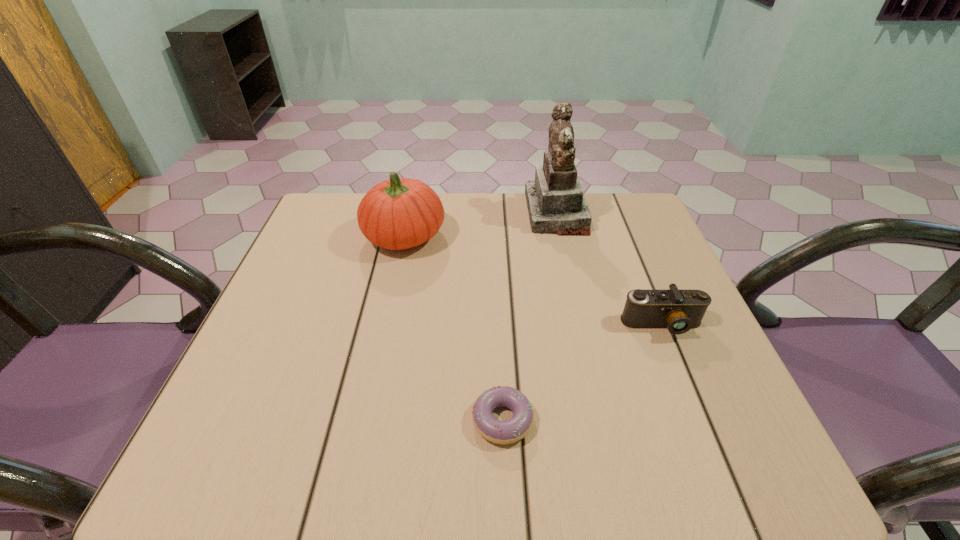
In the image, there is a desktop. Identify the location of blank space at the far edge. point(478,194).

Where is `vacant position at the near edge of the desktop`? This screenshot has height=540, width=960. vacant position at the near edge of the desktop is located at coordinates (640, 434).

The width and height of the screenshot is (960, 540). In the image, there is a desktop. What are the coordinates of `free region at the left edge` in the screenshot? It's located at (314, 258).

Identify the location of vacant space at the right edge of the desktop. This screenshot has width=960, height=540. (694, 379).

The height and width of the screenshot is (540, 960). In order to click on vacant area at the far left corner of the desktop in this screenshot , I will do `click(303, 234)`.

Locate an element on the screen. The height and width of the screenshot is (540, 960). vacant space at the far right corner of the desktop is located at coordinates (626, 206).

Locate an element on the screen. free area in between the third object from left to right and the third farthest object is located at coordinates [609, 269].

At what (x,y) coordinates should I click in order to perform the action: click on free space between the second tallest object and the doughnut. Please return your answer as a coordinate pair (x, y). The image size is (960, 540). Looking at the image, I should click on (453, 328).

Where is `vacant area that lies between the leftmost object and the third farthest object`? The image size is (960, 540). vacant area that lies between the leftmost object and the third farthest object is located at coordinates (533, 280).

Image resolution: width=960 pixels, height=540 pixels. Find the location of `empty space between the figurine and the doughnut`. empty space between the figurine and the doughnut is located at coordinates (529, 316).